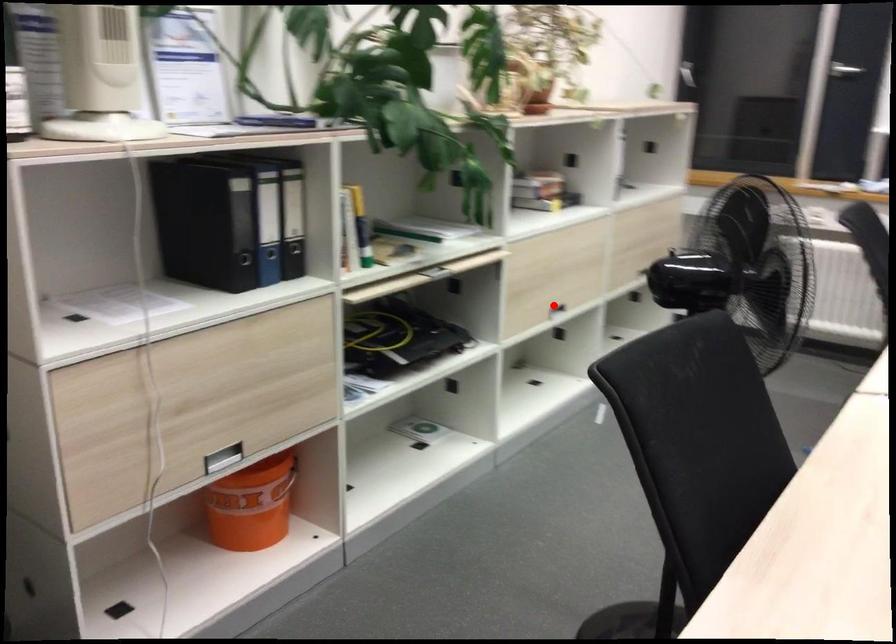
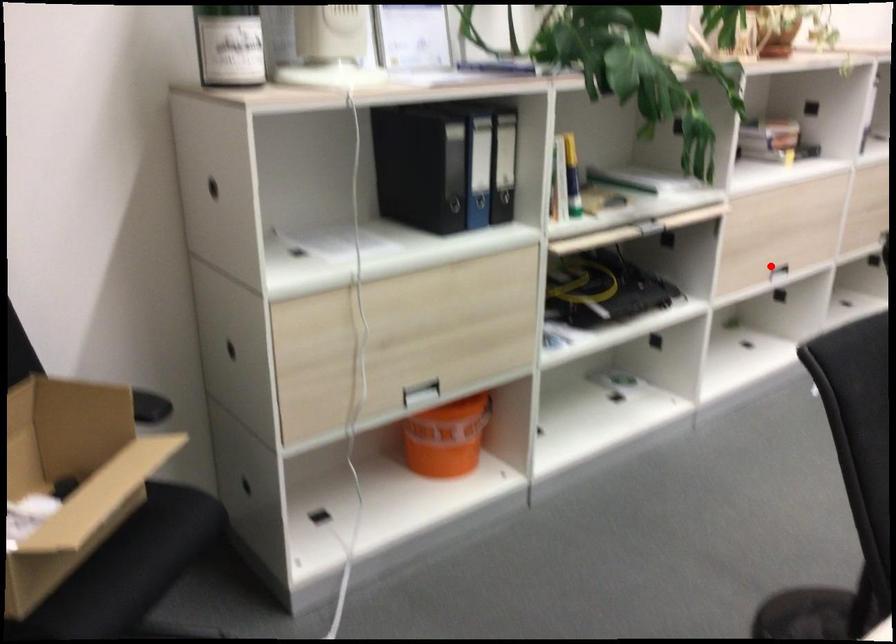
I am providing you with two images of the same scene from different viewpoints. A red point is marked on the first image and another point is marked on the second image. Does the point marked in image1 correspond to the same location as the one in image2?

Yes